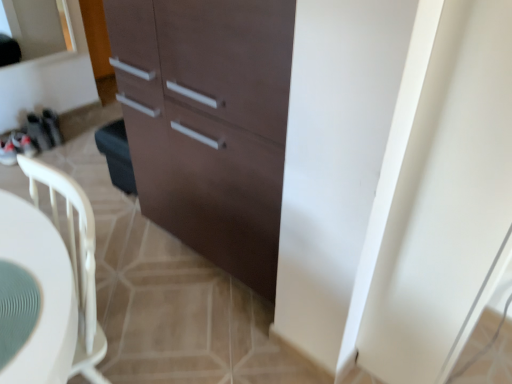
Question: Considering the relative positions of white plastic chair at center-left and white glossy screen door at right in the image provided, is white plastic chair at center-left to the left or to the right of white glossy screen door at right?

Choices:
 (A) right
 (B) left

Answer: (B)

Question: Is point (39, 168) closer or farther from the camera than point (391, 314)?

Choices:
 (A) farther
 (B) closer

Answer: (B)

Question: Based on their relative distances, which object is farther from the matte brown cabinet at center?

Choices:
 (A) teal textured placemat at lower left
 (B) white glossy screen door at right
 (C) white plastic chair at center-left

Answer: (A)

Question: Considering the real-world distances, which object is farthest from the white glossy screen door at right?

Choices:
 (A) matte brown cabinet at center
 (B) white plastic chair at center-left
 (C) teal textured placemat at lower left

Answer: (C)